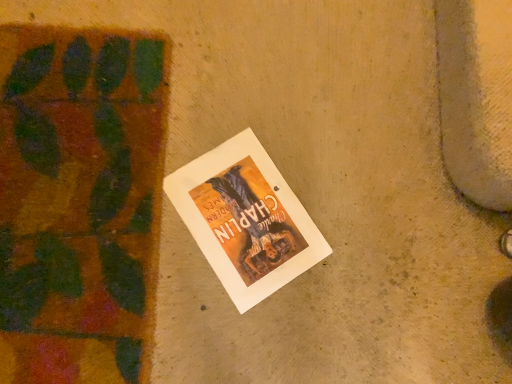
The width and height of the screenshot is (512, 384). In order to click on vacant point to the right of green leafy plant at left in this screenshot , I will do `click(285, 220)`.